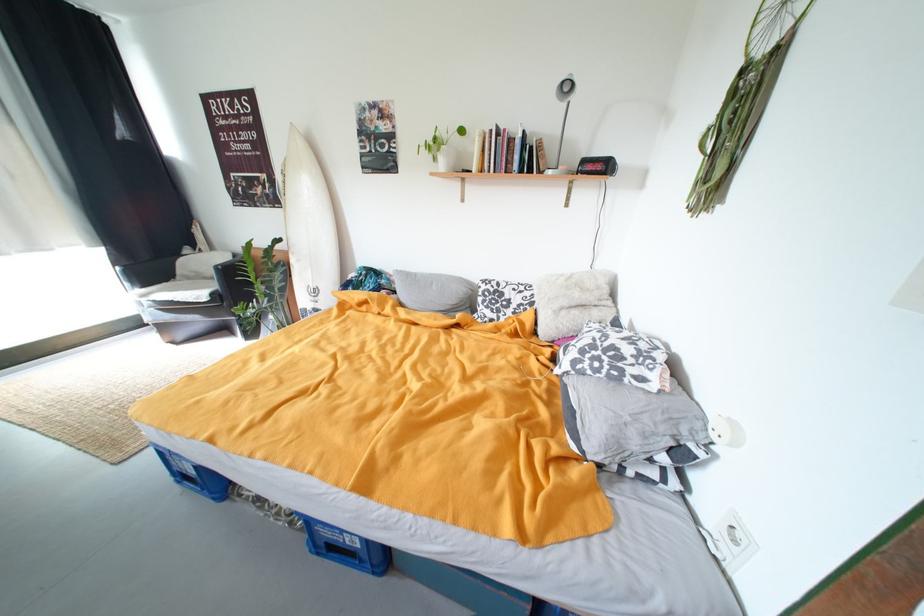
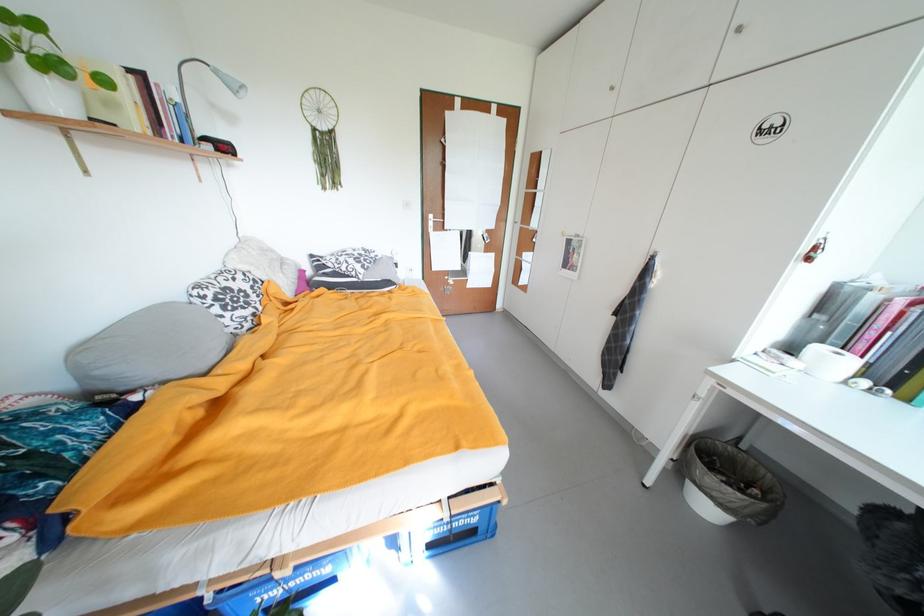
The point at (488, 290) is marked in the first image. Where is the corresponding point in the second image?

(211, 299)